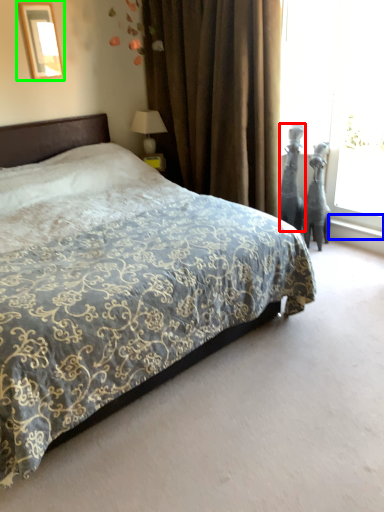
Question: Considering the real-world distances, which object is farthest from sculpture (highlighted by a red box)? window sill (highlighted by a blue box) or picture frame (highlighted by a green box)?

Choices:
 (A) window sill
 (B) picture frame

Answer: (B)